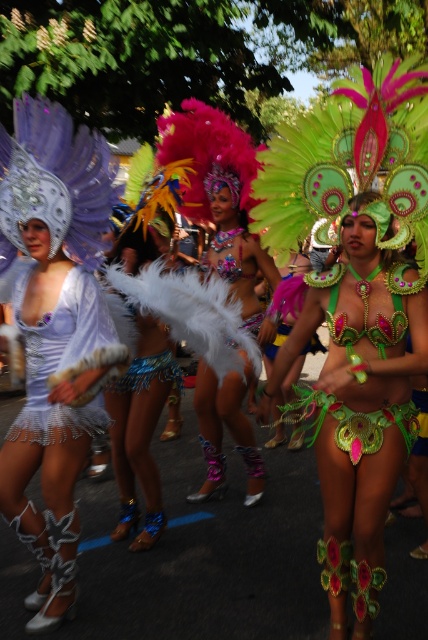
You are a photographer at the carnival. You want to take a closeup shot of the green sequined bikini at center. According to the coordinates provided, where should you aim your camera?

You should aim your camera at point 0.642 on the x axis and 0.836 on the y axis to capture the green sequined bikini at center.

You are a photographer at the carnival and want to capture a photo where both the matte white feathers at left and the green sequined bikini at center are clearly visible. Given their height difference, which object should you focus on first to ensure both are in frame?

The matte white feathers at left is much taller than the green sequined bikini at center. To ensure both are in frame, focus on the matte white feathers at left first, then adjust to include the green sequined bikini at center.